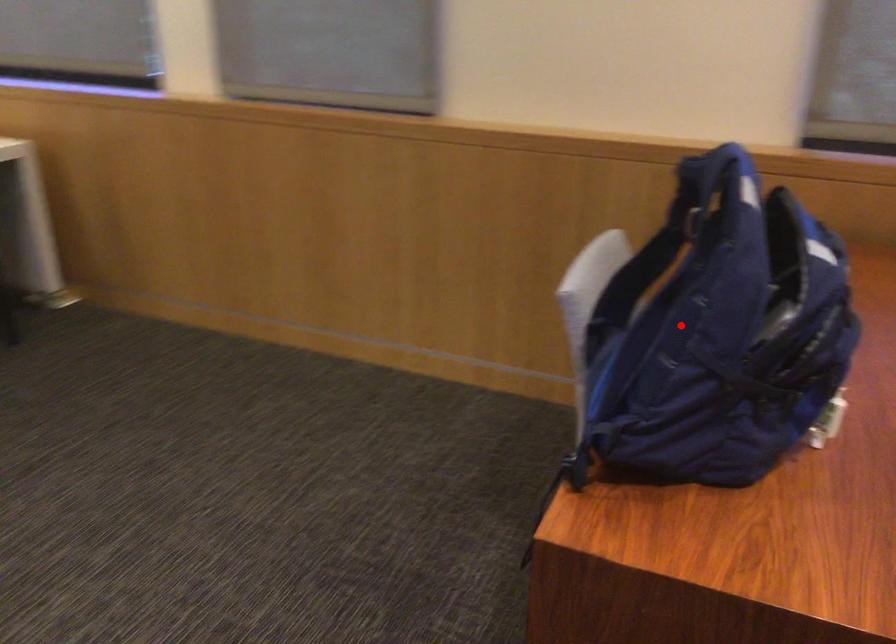
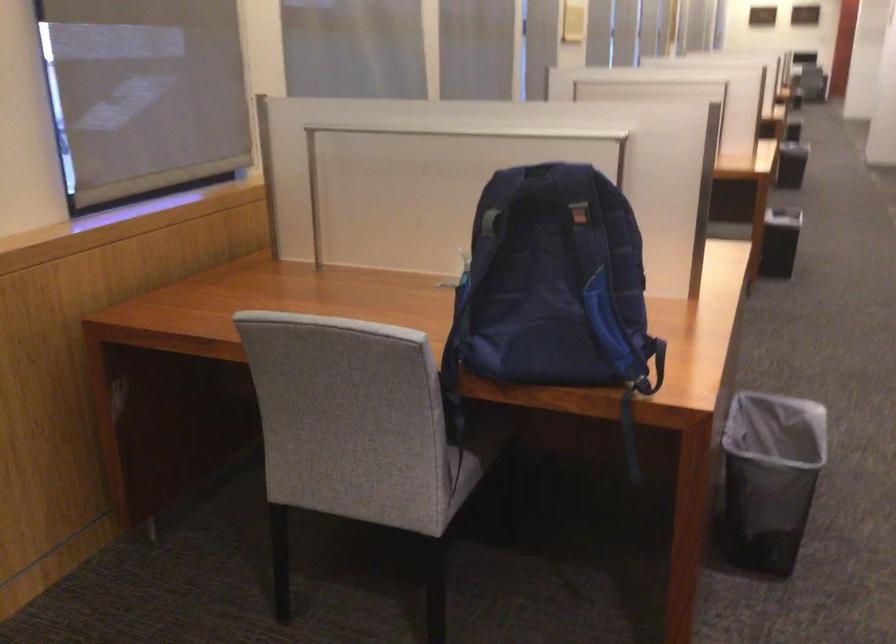
Find the pixel in the second image that matches the highlighted location in the first image.

(552, 281)